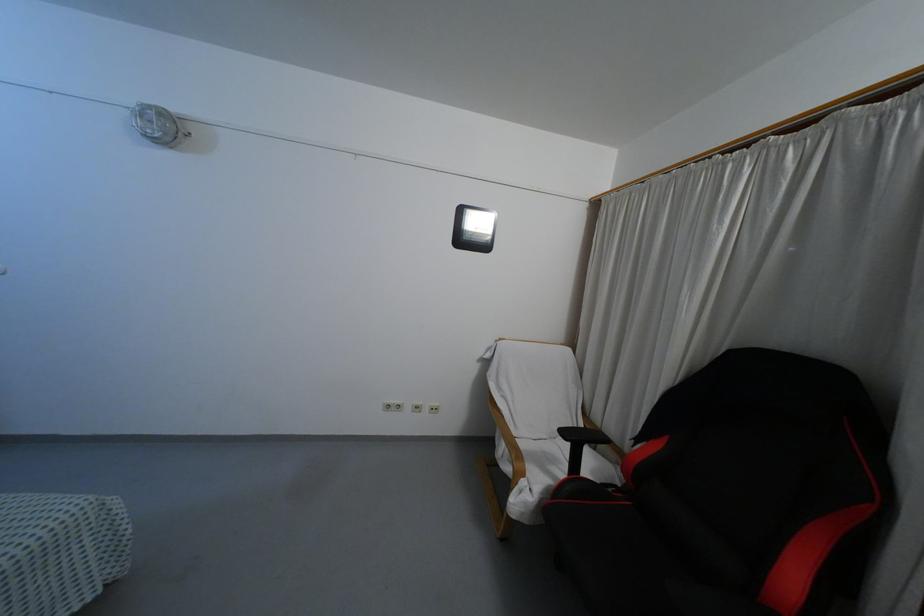
This screenshot has height=616, width=924. Find the location of `black chair armrest`. black chair armrest is located at coordinates (601, 439).